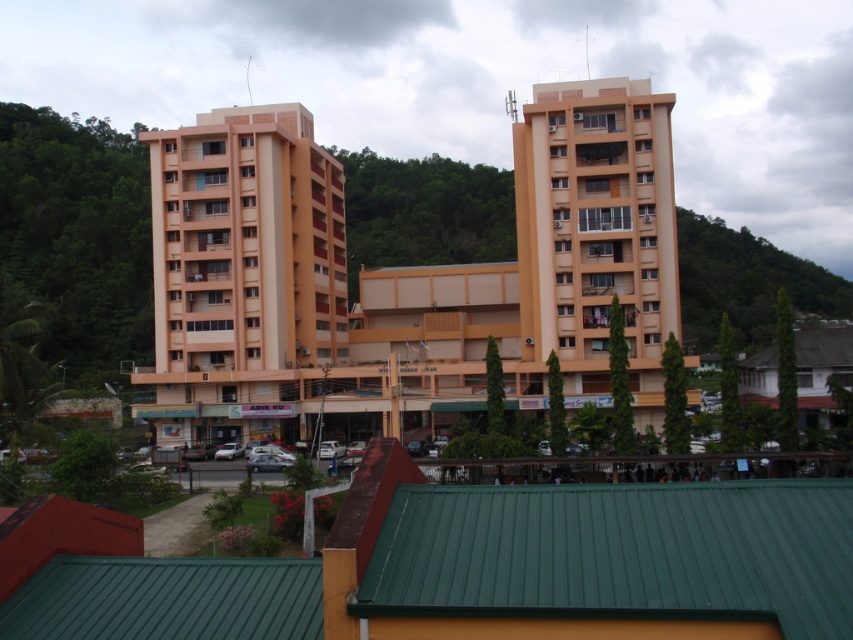
You are standing at the entrance of the residential complex and need to locate the matte orange building at center. According to the coordinates provided, where should you look relative to your current position?

The matte orange building at center is located at coordinates point (403, 276), which means it is positioned at the center of the scene. Since you are at the entrance, you should look straight ahead to find it.

Based on the scene description, which object is positioned to the left of the other between the matte orange building at center and the green leafy hillside at upper right?

The matte orange building at center is positioned to the left of the green leafy hillside at upper right.

You are standing in front of the residential complex and want to take a photo that includes both the matte orange building at center and the green leafy hillside at upper right. Which object will appear larger in the photo?

The matte orange building at center will appear larger in the photo because it is closer to the viewer than the green leafy hillside at upper right.